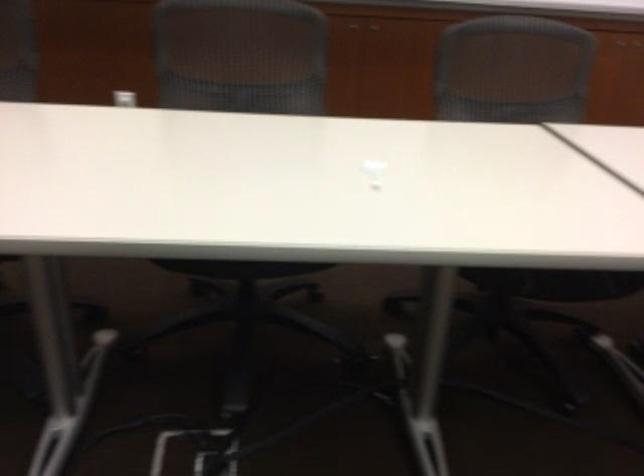
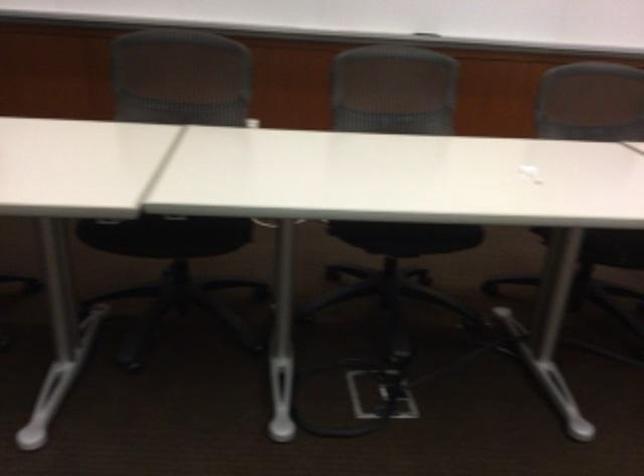
Question: How did the camera likely rotate?

Choices:
 (A) Left
 (B) Right
 (C) Up
 (D) Down

Answer: (C)